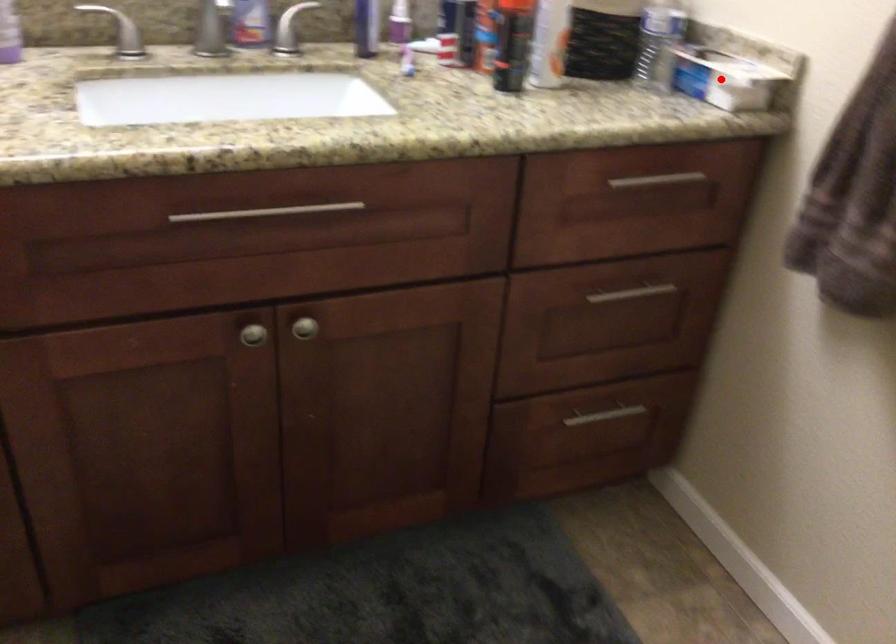
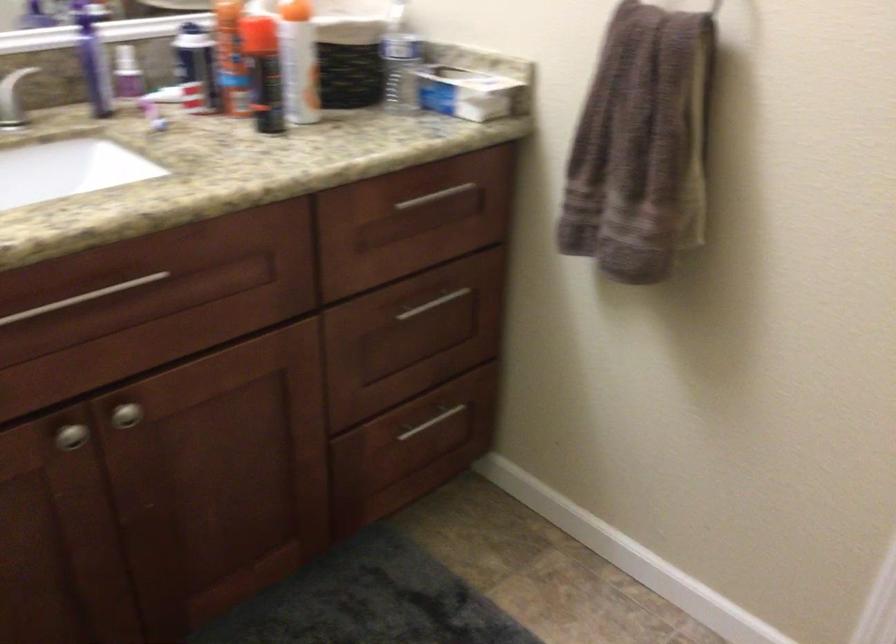
In the second image, find the point that corresponds to the highlighted location in the first image.

(470, 91)